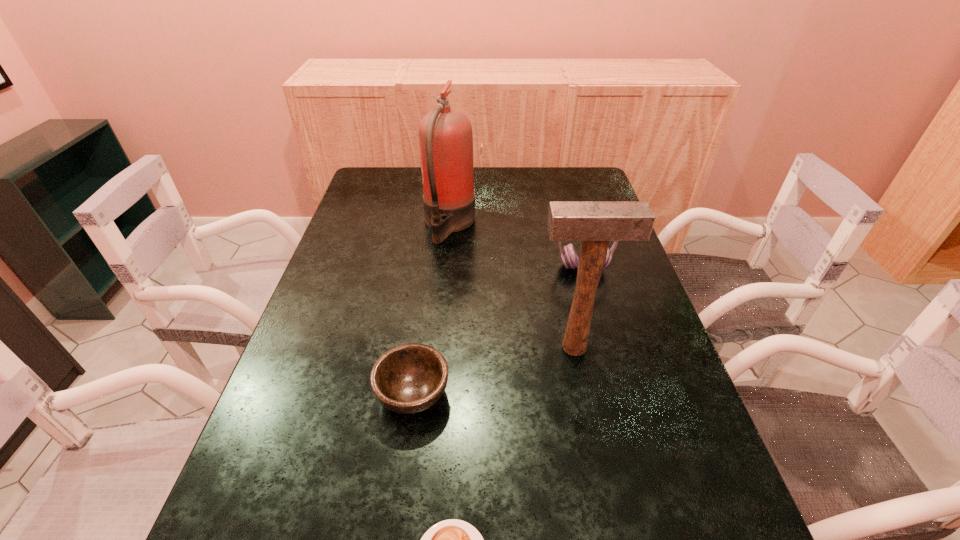
Image resolution: width=960 pixels, height=540 pixels. Find the location of `fire extinguisher`. fire extinguisher is located at coordinates (445, 135).

This screenshot has height=540, width=960. Identify the location of mallet. (595, 223).

At what (x,y) coordinates should I click in order to perform the action: click on headset. Please return your answer as a coordinate pair (x, y). Looking at the image, I should click on (569, 256).

Identify the location of the third shortest object. Image resolution: width=960 pixels, height=540 pixels. (569, 256).

Image resolution: width=960 pixels, height=540 pixels. In order to click on the second shortest object in this screenshot , I will do `click(410, 378)`.

The height and width of the screenshot is (540, 960). Identify the location of the fourth farthest object. (410, 378).

Locate an element on the screen. The height and width of the screenshot is (540, 960). vacant space situated at the nozzle of the fire extinguisher is located at coordinates (541, 224).

Find the location of a particular element. The image size is (960, 540). free space located 0.330m on the left of the mallet is located at coordinates (391, 347).

Locate an element on the screen. vacant region located on the headband and ear cups of the headset is located at coordinates (595, 312).

I want to click on vacant space situated 0.080m on the right of the fourth farthest object, so click(489, 394).